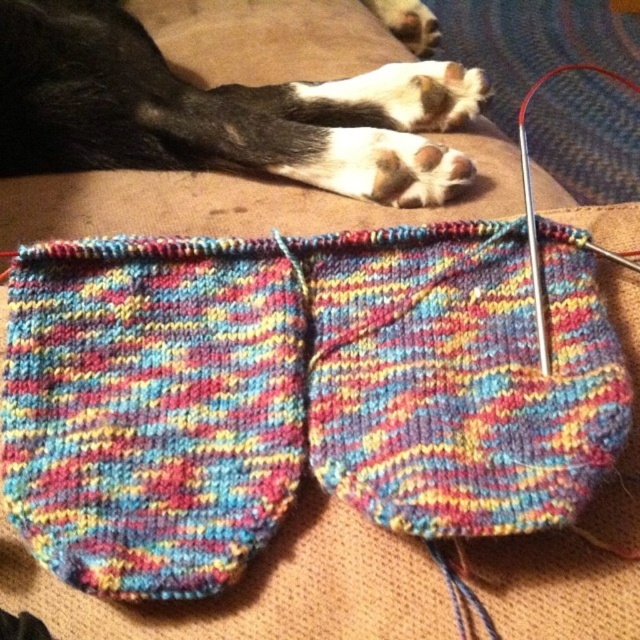
Question: In this image, where is multicolored knitted sock at center located relative to metallic silver knitting needle at upper right?

Choices:
 (A) right
 (B) left

Answer: (B)

Question: Which point is farther to the camera?

Choices:
 (A) black fur paw at upper left
 (B) multicolored knitted sock at center

Answer: (A)

Question: Can you confirm if multicolored knitted sock at center is smaller than metallic silver knitting needle at upper right?

Choices:
 (A) yes
 (B) no

Answer: (A)

Question: Estimate the real-world distances between objects in this image. Which object is farther from the multicolored knitted sock at center?

Choices:
 (A) black fur paw at upper left
 (B) metallic silver knitting needle at upper right

Answer: (B)

Question: Observing the image, what is the correct spatial positioning of black fur paw at upper left in reference to metallic silver knitting needle at upper right?

Choices:
 (A) below
 (B) above

Answer: (A)

Question: Which object is closer to the camera taking this photo?

Choices:
 (A) black fur paw at upper left
 (B) metallic silver knitting needle at upper right
 (C) multicolored knitted sock at center

Answer: (C)